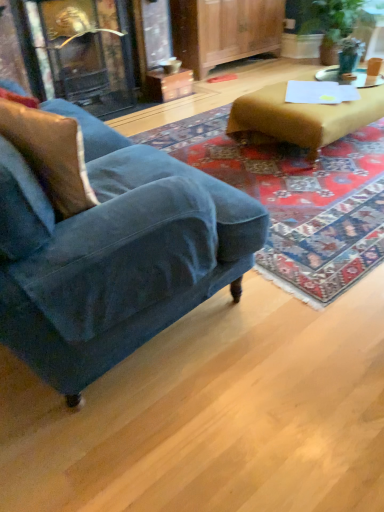
Where is `free space in front of brown leather ottoman at upper right`? free space in front of brown leather ottoman at upper right is located at coordinates (320, 192).